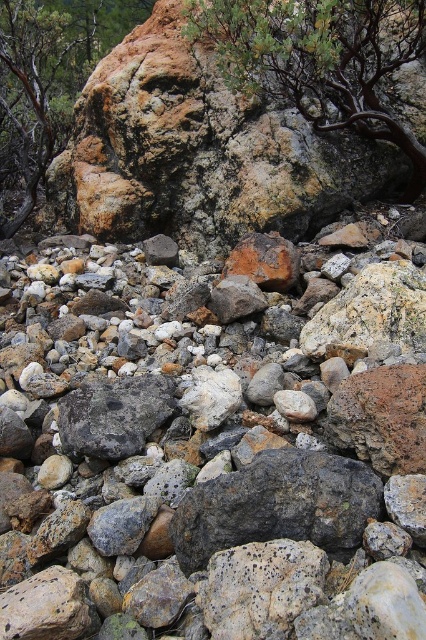
In the scene described, there is a green textured rock at upper center and point [48,83]. Which object is located higher in the image?

The green textured rock at upper center is located higher in the image than point [48,83].

From the picture: You are standing at the viewpoint in the image and want to reach the point marked as point (89, 35). Is the point marked as point (293, 68) blocking your path?

Point (293, 68) is in front of point (89, 35), so it would block your path to point (89, 35).